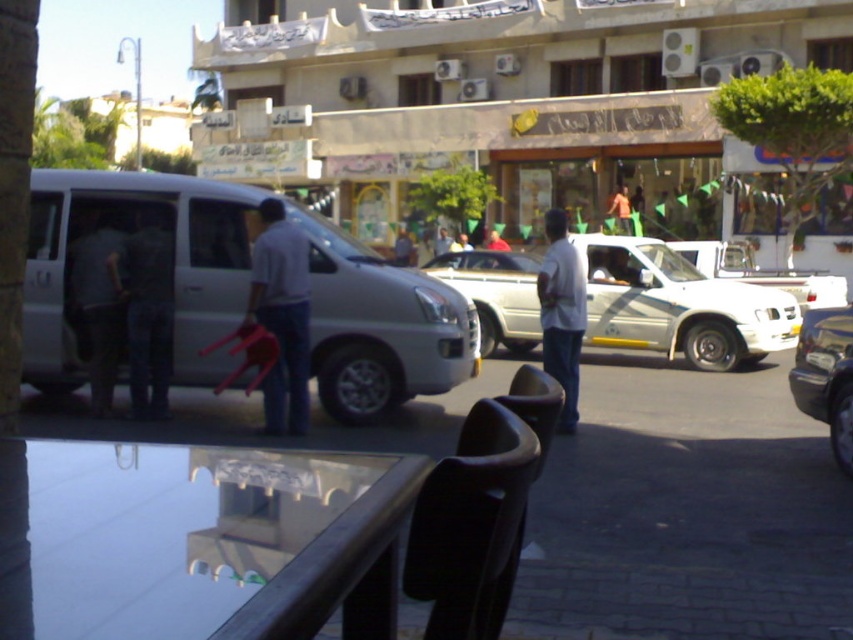
Which is below, white matte van at left or white matte truck at center?

white matte van at left is lower down.

Can you confirm if white matte van at left is taller than white matte truck at center?

In fact, white matte van at left may be shorter than white matte truck at center.

What do you see at coordinates (128, 230) in the screenshot?
I see `white matte van at left` at bounding box center [128, 230].

At what (x,y) coordinates should I click in order to perform the action: click on white matte van at left. Please return your answer as a coordinate pair (x, y). This screenshot has width=853, height=640. Looking at the image, I should click on (128, 230).

Does white matte van at left have a greater height compared to white cotton shirt at center?

Correct, white matte van at left is much taller as white cotton shirt at center.

Is white matte van at left positioned in front of white cotton shirt at center?

Yes, it is.

Is point (309, 230) positioned in front of point (567, 250)?

No, (309, 230) is further to viewer.

Find the location of a particular element. This screenshot has height=640, width=853. white matte van at left is located at coordinates (128, 230).

Is white matte van at left further to camera compared to dark gray fabric at left?

Yes, white matte van at left is behind dark gray fabric at left.

Is white matte van at left shorter than dark gray fabric at left?

Indeed, white matte van at left has a lesser height compared to dark gray fabric at left.

What do you see at coordinates (128, 230) in the screenshot?
I see `white matte van at left` at bounding box center [128, 230].

Where is `white matte van at left`? Image resolution: width=853 pixels, height=640 pixels. white matte van at left is located at coordinates (128, 230).